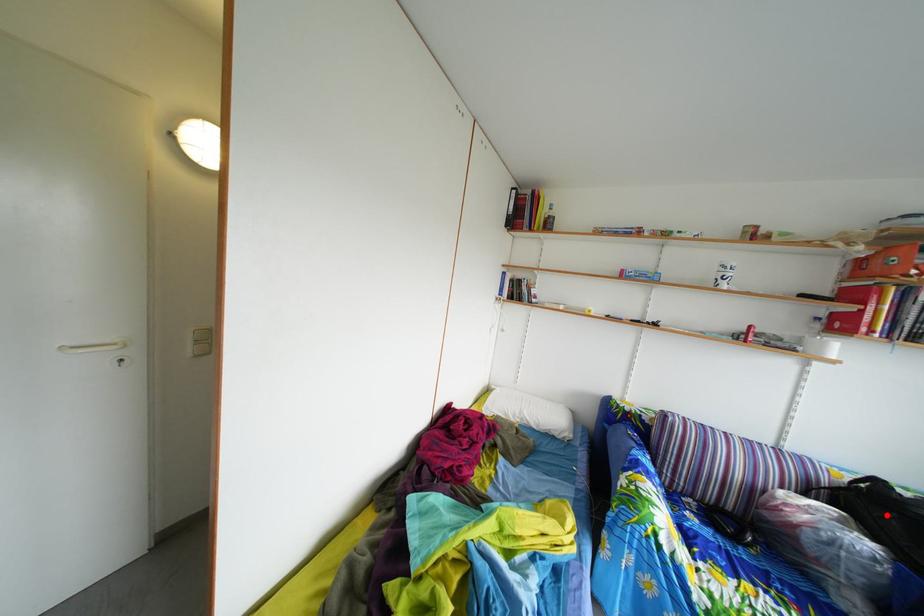
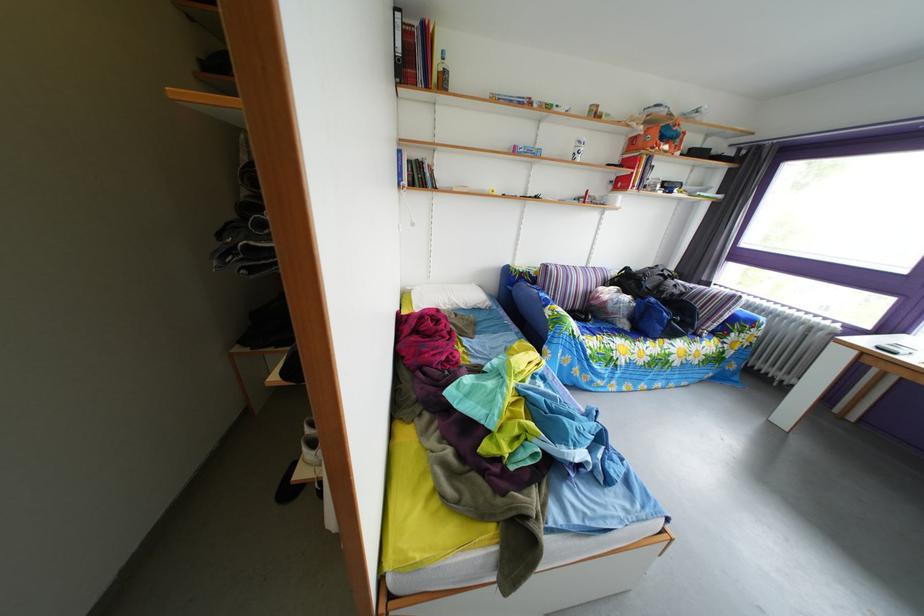
The point at the highlighted location is marked in the first image. Where is the corresponding point in the second image?

(638, 289)